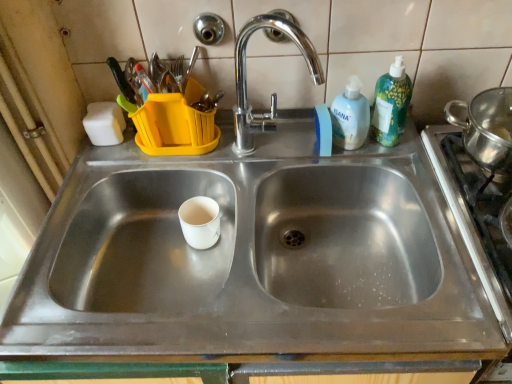
Image resolution: width=512 pixels, height=384 pixels. I want to click on vacant area situated to the left side of white plastic bottle at upper right, marked as the 2th cleaning product in a right-to-left arrangement, so click(x=254, y=145).